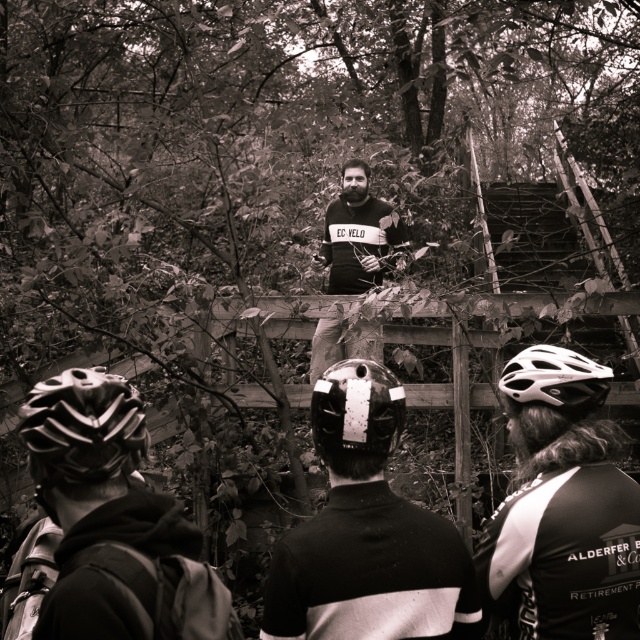
Does dark gray sweater at center have a larger size compared to white matte bicycle helmet at center?

Indeed, dark gray sweater at center has a larger size compared to white matte bicycle helmet at center.

Is point (371, 244) more distant than point (582, 358)?

Yes.

At what (x,y) coordinates should I click in order to perform the action: click on dark gray sweater at center. Please return your answer as a coordinate pair (x, y). This screenshot has width=640, height=640. Looking at the image, I should click on (356, 234).

Where is `dark gray sweater at center`? This screenshot has height=640, width=640. dark gray sweater at center is located at coordinates (356, 234).

The width and height of the screenshot is (640, 640). I want to click on dark gray sweater at center, so click(356, 234).

Who is shorter, dark gray sweater at center or shiny black helmet at center?

With less height is shiny black helmet at center.

This screenshot has height=640, width=640. What are the coordinates of `dark gray sweater at center` in the screenshot? It's located at (356, 234).

Where is `matte black helmet at lower left`? The height and width of the screenshot is (640, 640). matte black helmet at lower left is located at coordinates (113, 522).

Locate an element on the screen. The height and width of the screenshot is (640, 640). matte black helmet at lower left is located at coordinates (113, 522).